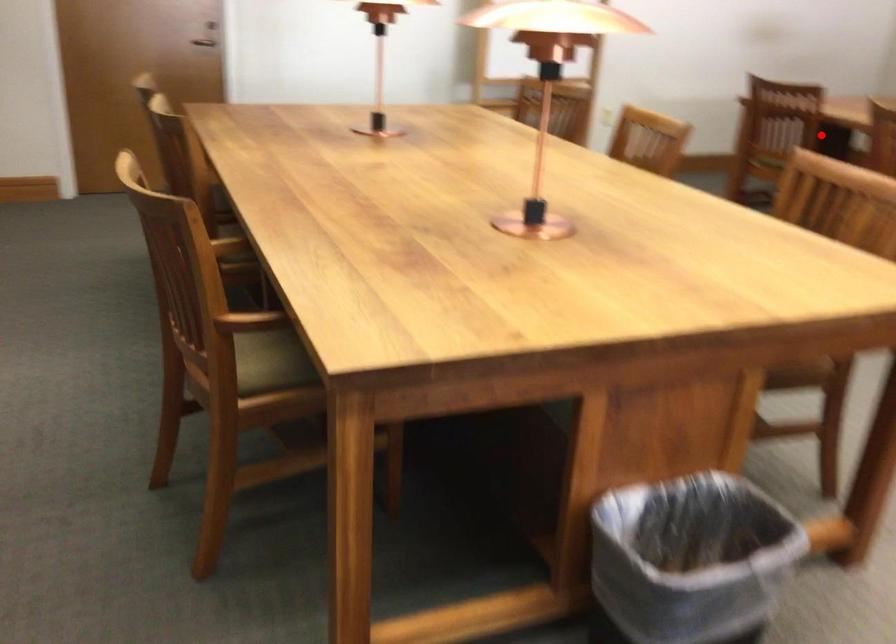
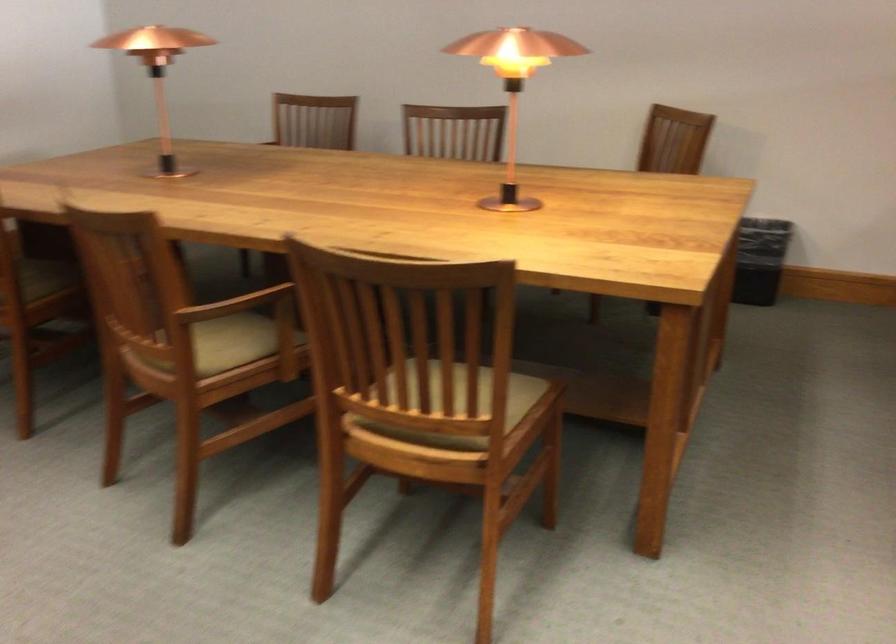
Locate, in the second image, the point that corresponds to the highlighted location in the first image.

(44, 279)